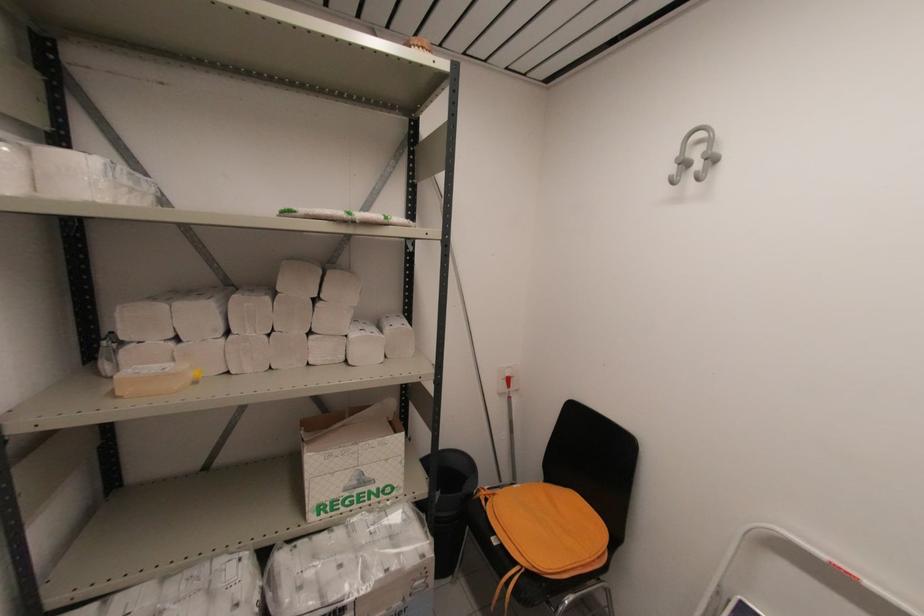
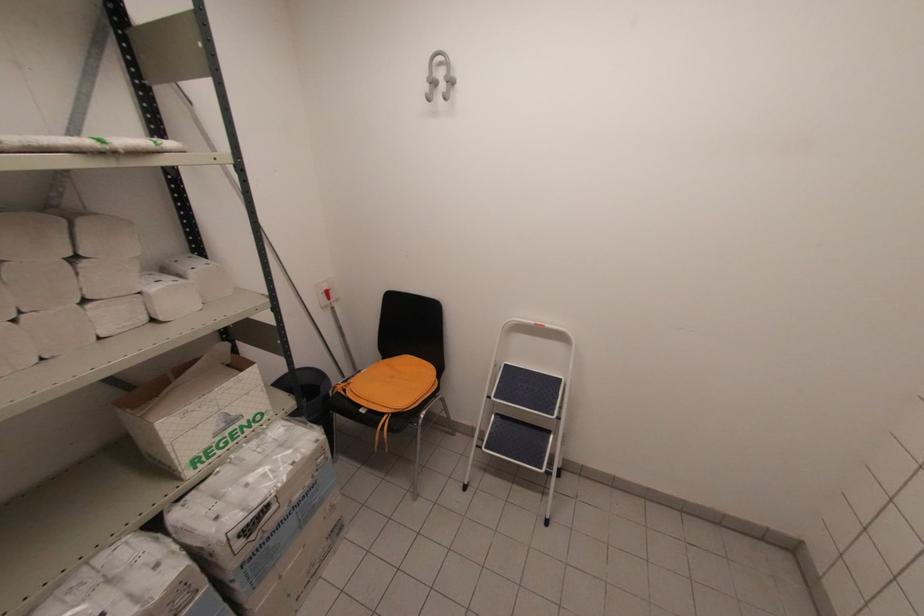
Find the pixel in the second image that matches (509,387) in the first image.

(330, 299)